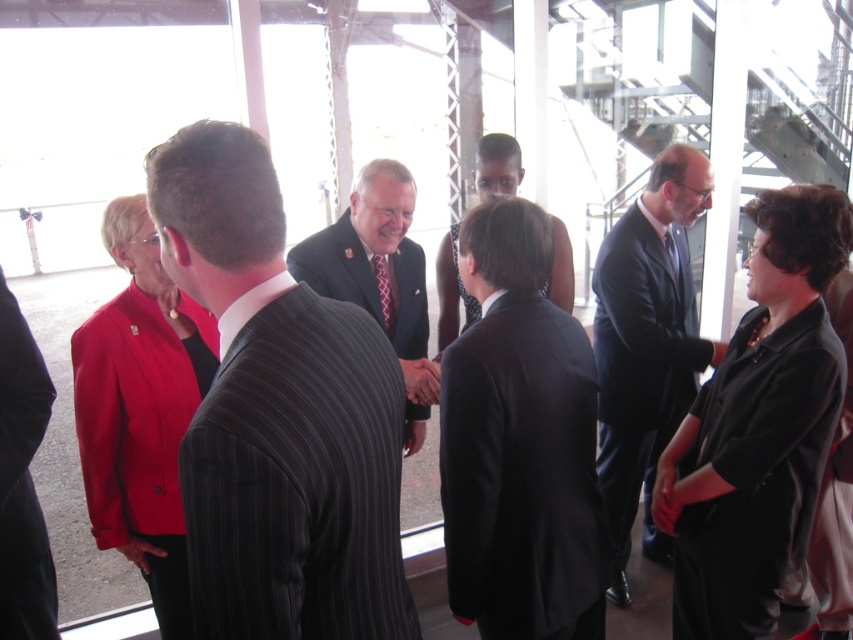
Question: Among these objects, which one is farthest from the camera?

Choices:
 (A) black suit at center
 (B) matte red blazer at left
 (C) black smooth suit at center

Answer: (A)

Question: Is black satin blouse at center to the left of black smooth suit at center from the viewer's perspective?

Choices:
 (A) no
 (B) yes

Answer: (A)

Question: Which object appears closest to the camera in this image?

Choices:
 (A) black pinstripe suit at left
 (B) matte red blazer at left
 (C) dark pinstripe suit at center
 (D) matte black suit at center

Answer: (C)

Question: Considering the real-world distances, which object is farthest from the black suit at center?

Choices:
 (A) dark blue suit at center
 (B) dark pinstripe suit at center
 (C) black satin blouse at center
 (D) matte red blazer at left

Answer: (B)

Question: Does black pinstripe suit at left have a lesser width compared to matte black suit at center?

Choices:
 (A) yes
 (B) no

Answer: (A)

Question: Does black smooth suit at center have a smaller size compared to black suit at center?

Choices:
 (A) yes
 (B) no

Answer: (A)